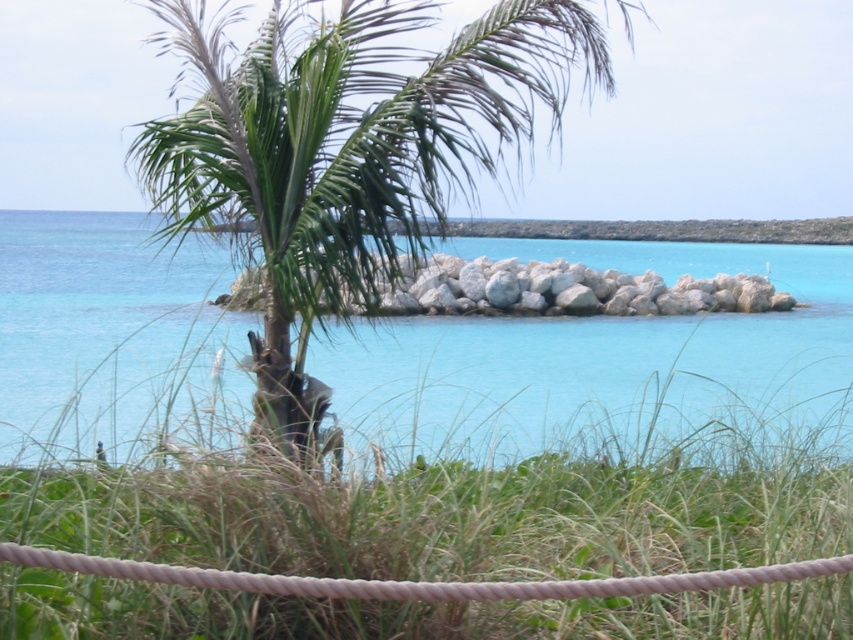
From the picture: Who is higher up, turquoise water at center or white rock at center?

Positioned higher is white rock at center.

Is point (596, 406) less distant than point (761, 307)?

Yes, point (596, 406) is in front of point (761, 307).

Which is in front, point (111, 316) or point (592, 282)?

Point (111, 316) is more forward.

I want to click on turquoise water at center, so click(599, 358).

Which of these two, green grass at center or white rock at center, stands shorter?

Standing shorter between the two is green grass at center.

Who is higher up, green grass at center or white rock at center?

Positioned higher is white rock at center.

Who is more distant from viewer, (x=416, y=460) or (x=560, y=259)?

The point (x=560, y=259) is behind.

The image size is (853, 640). Identify the location of green grass at center. (444, 515).

From the picture: Is the position of turquoise water at center less distant than that of green leafy palm tree at center?

That is False.

From the picture: Measure the distance between point (230, 362) and camera.

The distance of point (230, 362) from camera is 7.80 meters.

Measure the distance between turquoise water at center and camera.

The distance of turquoise water at center from camera is 5.04 meters.

I want to click on turquoise water at center, so click(x=599, y=358).